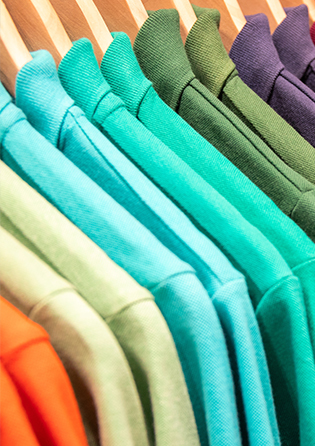
Find the location of a particular element. wooden hanger is located at coordinates (307, 1), (270, 6), (233, 13), (179, 8), (133, 10), (77, 18), (48, 24), (20, 53).